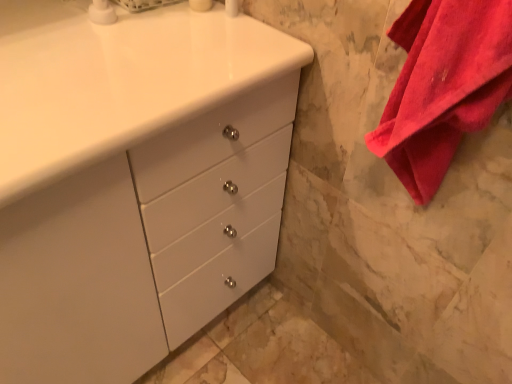
Question: Is point (165, 261) closer or farther from the camera than point (112, 14)?

Choices:
 (A) farther
 (B) closer

Answer: (A)

Question: Considering their positions, is white glossy cabinet at center located in front of or behind white glossy soap dispenser at upper left?

Choices:
 (A) behind
 (B) front

Answer: (B)

Question: Which object is positioned closest to the white glossy soap dispenser at upper left?

Choices:
 (A) red cotton towel at right
 (B) white glossy cabinet at center

Answer: (B)

Question: Considering the real-world distances, which object is closest to the white glossy soap dispenser at upper left?

Choices:
 (A) white glossy cabinet at center
 (B) red cotton towel at right

Answer: (A)